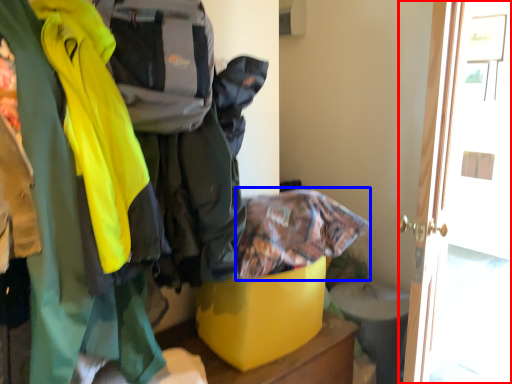
Question: Which object is closer to the camera taking this photo, door (highlighted by a red box) or cloak (highlighted by a blue box)?

Choices:
 (A) door
 (B) cloak

Answer: (B)